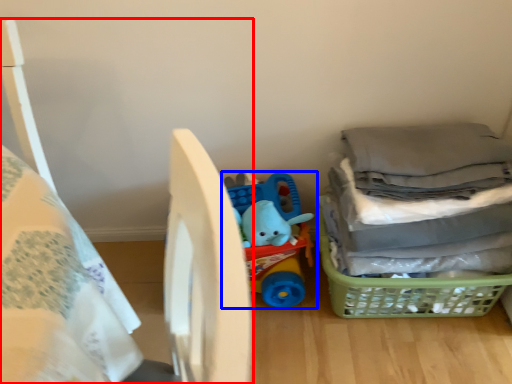
Question: Which point is closer to the camera, bed (highlighted by a red box) or toy (highlighted by a blue box)?

Choices:
 (A) bed
 (B) toy

Answer: (A)